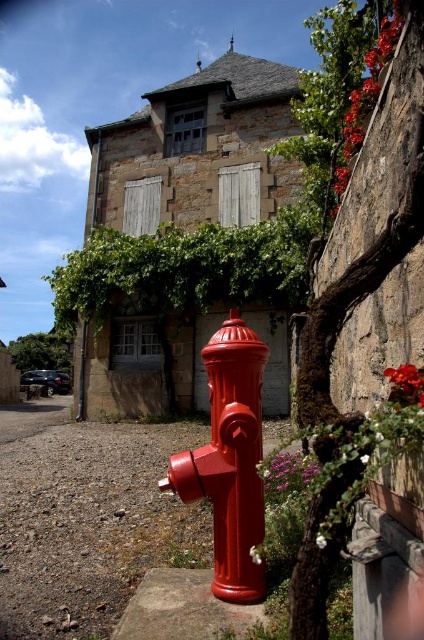
Question: Estimate the real-world distances between objects in this image. Which object is closer to the glossy red fire hydrant at center?

Choices:
 (A) purple matte flower at lower center
 (B) smooth stone wall at upper right

Answer: (A)

Question: Which of these objects is positioned farthest from the smooth stone wall at upper right?

Choices:
 (A) purple matte flower at lower center
 (B) smooth glossy petal at center right

Answer: (A)

Question: Is glossy red fire hydrant at center to the left of smooth glossy petal at center right from the viewer's perspective?

Choices:
 (A) yes
 (B) no

Answer: (A)

Question: Is glossy red fire hydrant at center below smooth stone wall at upper right?

Choices:
 (A) no
 (B) yes

Answer: (B)

Question: Which is farther from the smooth glossy petal at center right?

Choices:
 (A) purple matte flower at lower center
 (B) glossy red fire hydrant at center
 (C) smooth stone wall at upper right

Answer: (A)

Question: Is glossy red fire hydrant at center to the right of purple matte flower at lower center from the viewer's perspective?

Choices:
 (A) no
 (B) yes

Answer: (A)